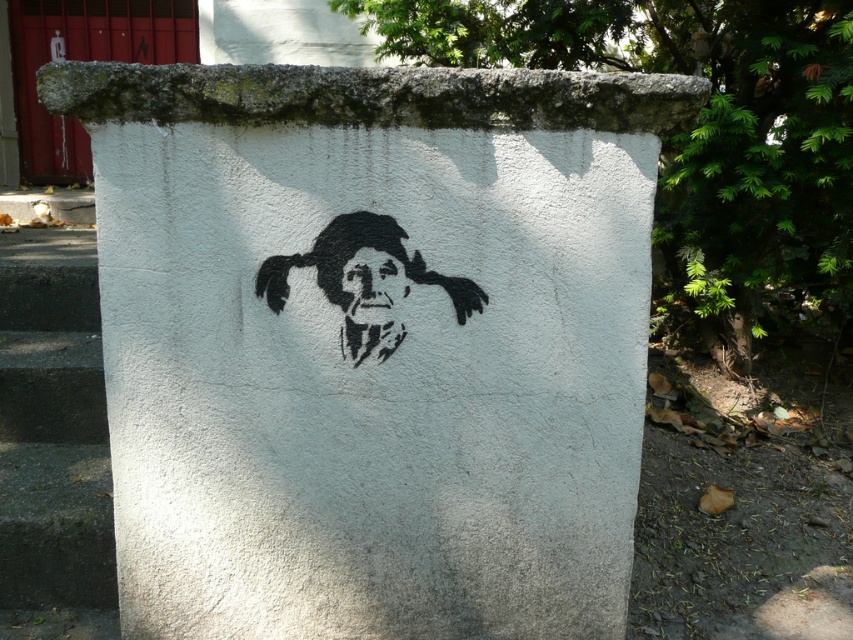
Question: Where is concrete stairs at lower left located in relation to black stencil face at center in the image?

Choices:
 (A) left
 (B) right

Answer: (A)

Question: Which of the following is the farthest from the observer?

Choices:
 (A) white concrete wall at center
 (B) black stencil face at center
 (C) concrete stairs at lower left

Answer: (C)

Question: Which object is the closest to the black stencil face at center?

Choices:
 (A) black spray paint at center
 (B) concrete stairs at lower left
 (C) white concrete wall at center

Answer: (A)

Question: Does white concrete wall at center have a lesser width compared to black stencil face at center?

Choices:
 (A) no
 (B) yes

Answer: (A)

Question: Does white concrete wall at center appear under black stencil face at center?

Choices:
 (A) yes
 (B) no

Answer: (A)

Question: Estimate the real-world distances between objects in this image. Which object is farther from the white concrete wall at center?

Choices:
 (A) concrete stairs at lower left
 (B) black stencil face at center
 (C) black spray paint at center

Answer: (A)